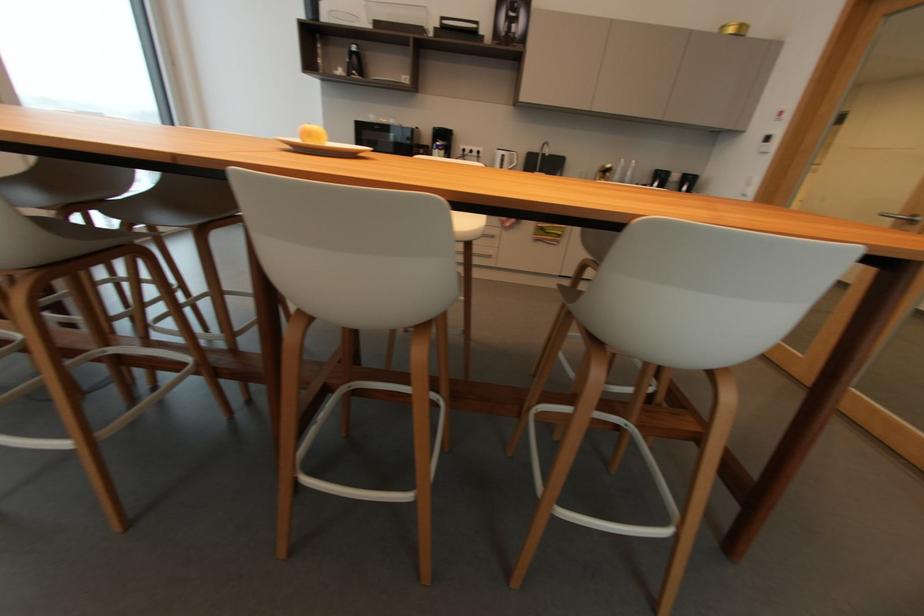
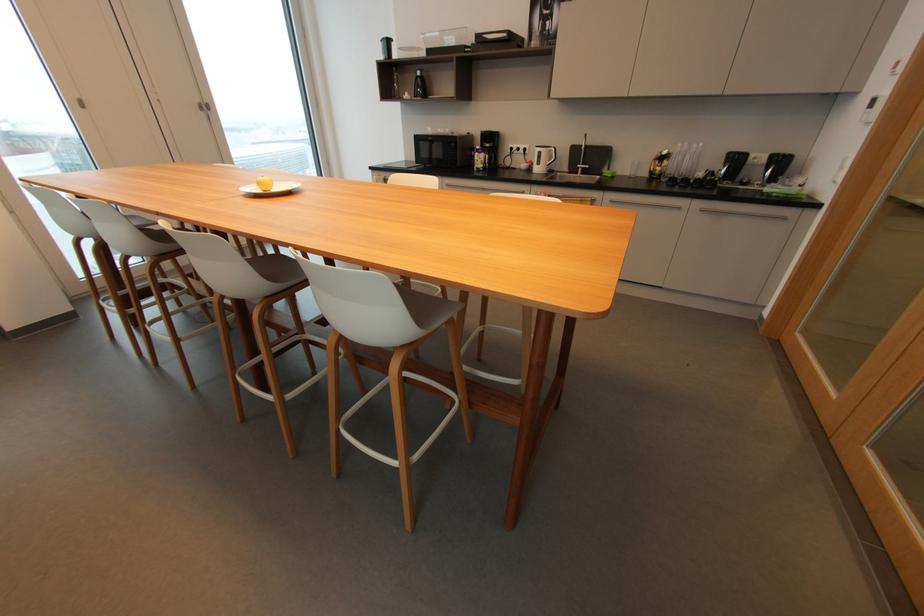
The point at (611, 175) is marked in the first image. Where is the corresponding point in the second image?

(669, 161)